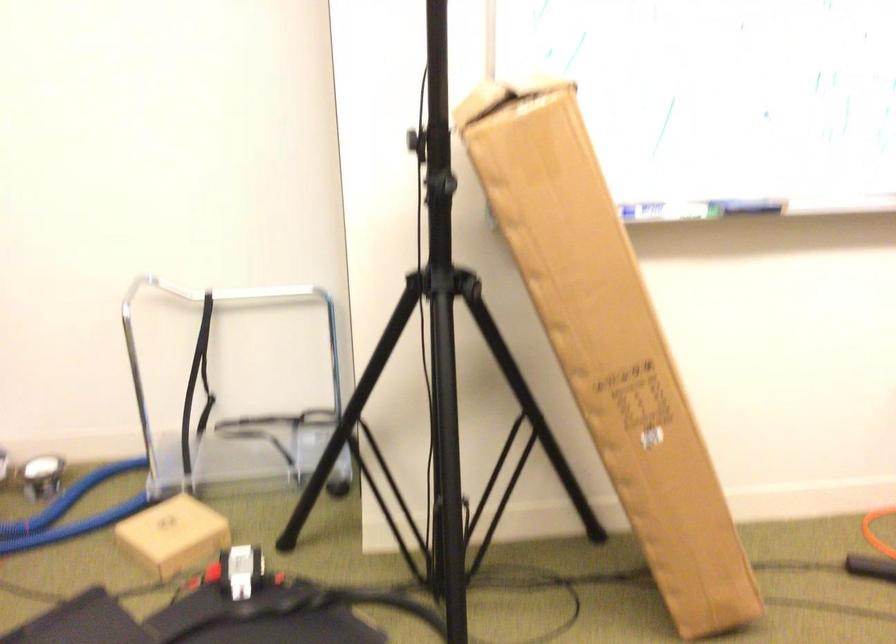
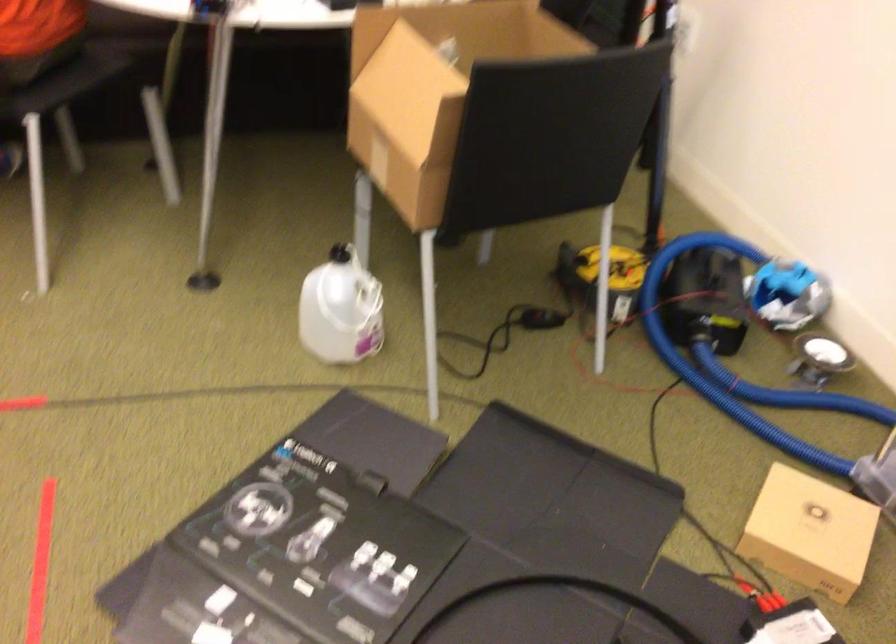
First-person continuous shooting, in which direction is the camera rotating?

The camera's rotation is toward left-down.